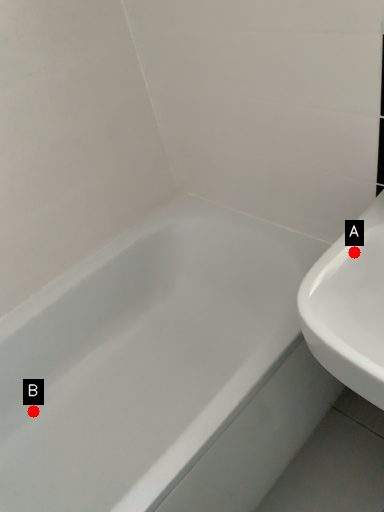
Question: Two points are circled on the image, labeled by A and B beside each circle. Which point is closer to the camera?

Choices:
 (A) A is closer
 (B) B is closer

Answer: (A)